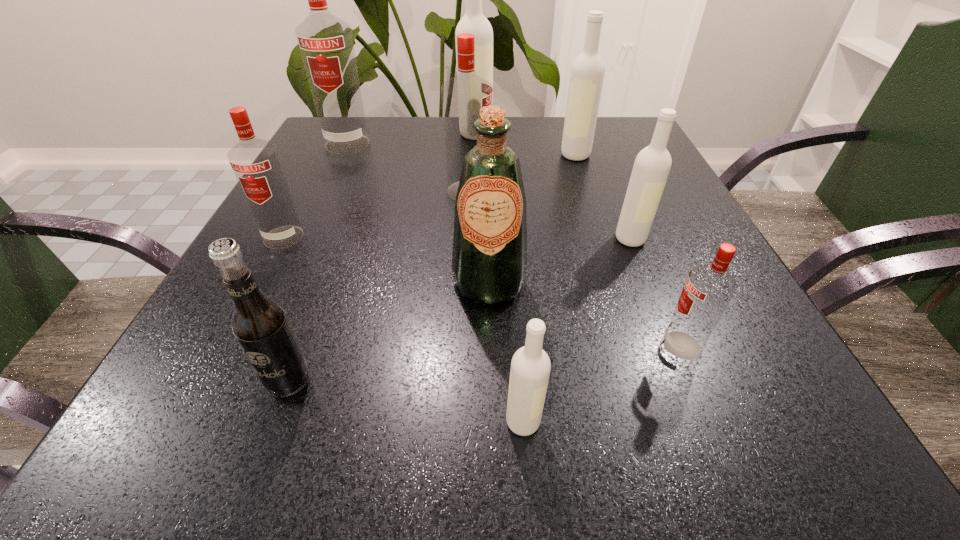
At what (x,y) coordinates should I click in order to perform the action: click on root beer. Please return your answer as a coordinate pair (x, y). This screenshot has height=540, width=960. Looking at the image, I should click on (260, 325).

At what (x,y) coordinates should I click in order to perform the action: click on the seventh farthest vodka. Please return your answer as a coordinate pair (x, y). The height and width of the screenshot is (540, 960). Looking at the image, I should click on (708, 290).

At what (x,y) coordinates should I click in order to perform the action: click on the smallest red vodka. Please return your answer as a coordinate pair (x, y). The height and width of the screenshot is (540, 960). Looking at the image, I should click on (708, 290).

At what (x,y) coordinates should I click in order to perform the action: click on the nearest vodka. Please return your answer as a coordinate pair (x, y). Looking at the image, I should click on (530, 367).

You are a GUI agent. You are given a task and a screenshot of the screen. Output one action in this format:
    pyautogui.click(x=<x>, y=<y>)
    Task: Click on the nearest object
    The width and height of the screenshot is (960, 540).
    Given the screenshot: What is the action you would take?
    pyautogui.click(x=530, y=367)

The image size is (960, 540). Find the location of `blank space located 0.220m on the left of the biggest white vodka`. blank space located 0.220m on the left of the biggest white vodka is located at coordinates (372, 134).

Where is `vacant region located on the front label of the biggest red vodka`? The width and height of the screenshot is (960, 540). vacant region located on the front label of the biggest red vodka is located at coordinates (307, 228).

I want to click on free space located 0.220m on the front label of the third nearest red vodka, so click(x=596, y=191).

Image resolution: width=960 pixels, height=540 pixels. I want to click on vacant space located on the right of the third smallest white vodka, so click(633, 154).

What are the coordinates of `vacant position located 0.130m on the front-facing side of the green olive oil` in the screenshot? It's located at (492, 381).